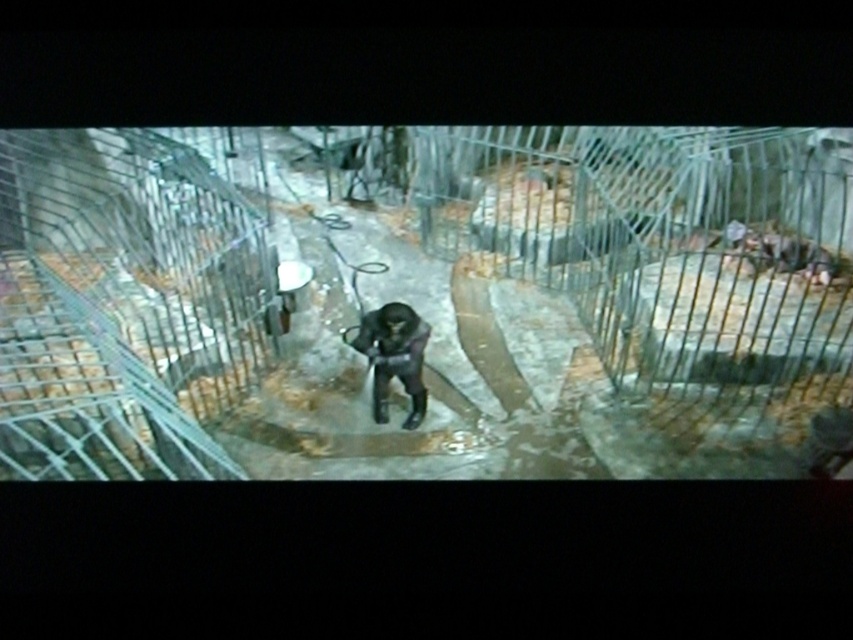
Is point (172, 456) positioned after point (413, 310)?

No.

Who is lower down, smooth concrete floor at center or black matte gorilla at center?

black matte gorilla at center is below.

Where is `smooth concrete floor at center`? Image resolution: width=853 pixels, height=640 pixels. smooth concrete floor at center is located at coordinates (425, 301).

The width and height of the screenshot is (853, 640). Find the location of `smooth concrete floor at center`. smooth concrete floor at center is located at coordinates (425, 301).